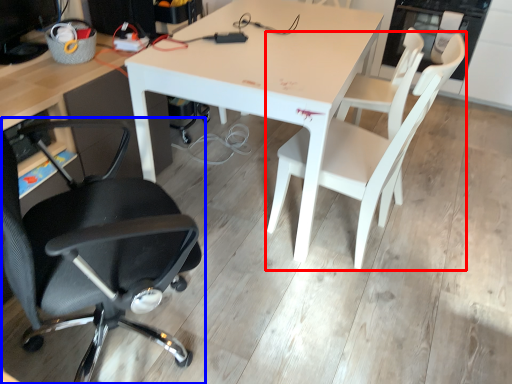
Question: Which of the following is the farthest to the observer, chair (highlighted by a red box) or chair (highlighted by a blue box)?

Choices:
 (A) chair
 (B) chair

Answer: (A)